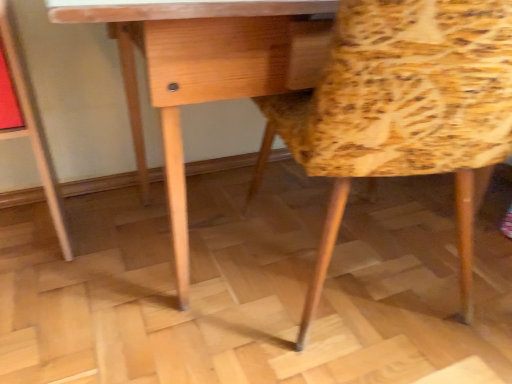
What do you see at coordinates (403, 108) in the screenshot? I see `woven straw chair at center` at bounding box center [403, 108].

The width and height of the screenshot is (512, 384). Find the location of `woven straw chair at center`. woven straw chair at center is located at coordinates (403, 108).

What is the approximate width of woven straw chair at center?

woven straw chair at center is 25.39 inches in width.

This screenshot has width=512, height=384. Find the location of `woven straw chair at center`. woven straw chair at center is located at coordinates (403, 108).